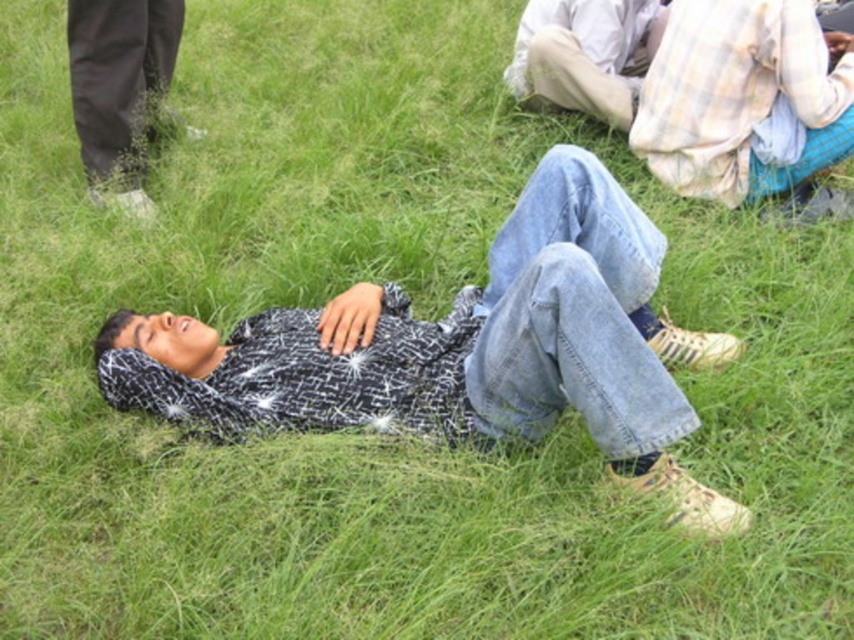
Question: Which object is closer to the camera taking this photo?

Choices:
 (A) light beige cotton pants at upper right
 (B) plaid fabric shirt at upper right
 (C) denim at lower center

Answer: (C)

Question: Is patterned shirt at center further to camera compared to plaid fabric shirt at upper right?

Choices:
 (A) no
 (B) yes

Answer: (A)

Question: Does patterned shirt at center have a smaller size compared to light beige cotton pants at upper right?

Choices:
 (A) yes
 (B) no

Answer: (B)

Question: Which of the following is the closest to the observer?

Choices:
 (A) (544, 1)
 (B) (475, 396)
 (C) (601, 429)

Answer: (C)

Question: Which point is farther to the camera?

Choices:
 (A) (747, 67)
 (B) (682, 413)

Answer: (A)

Question: Is denim at lower center smaller than light beige cotton pants at upper right?

Choices:
 (A) no
 (B) yes

Answer: (A)